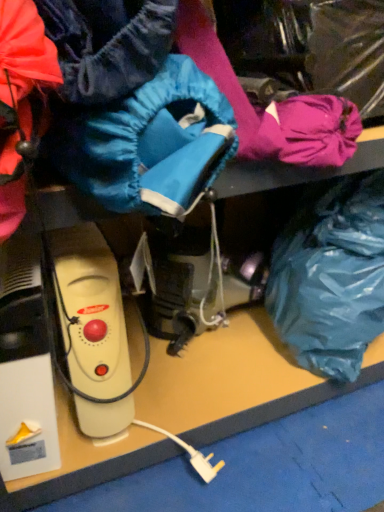
Question: Should I look upward or downward to see blue plastic bag at lower right?

Choices:
 (A) down
 (B) up

Answer: (A)